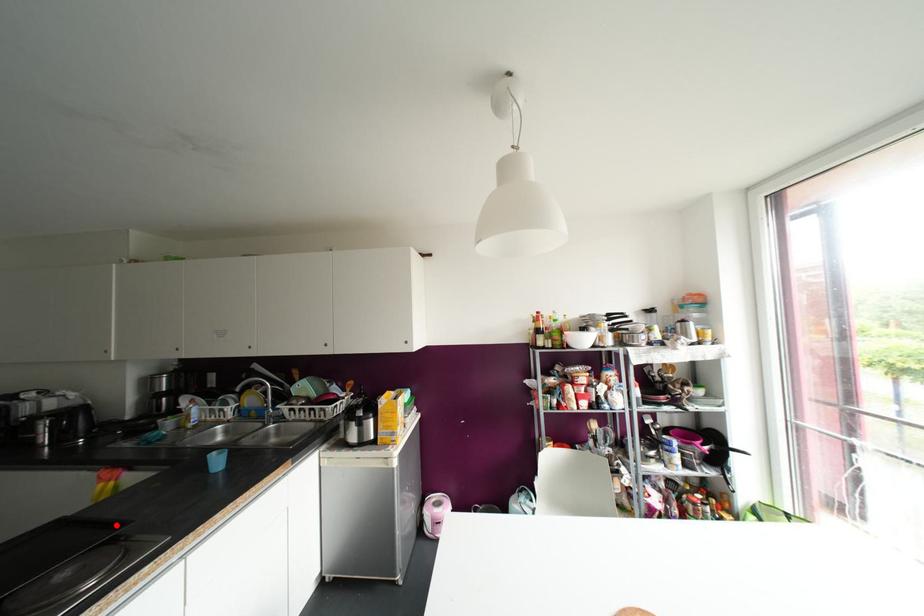
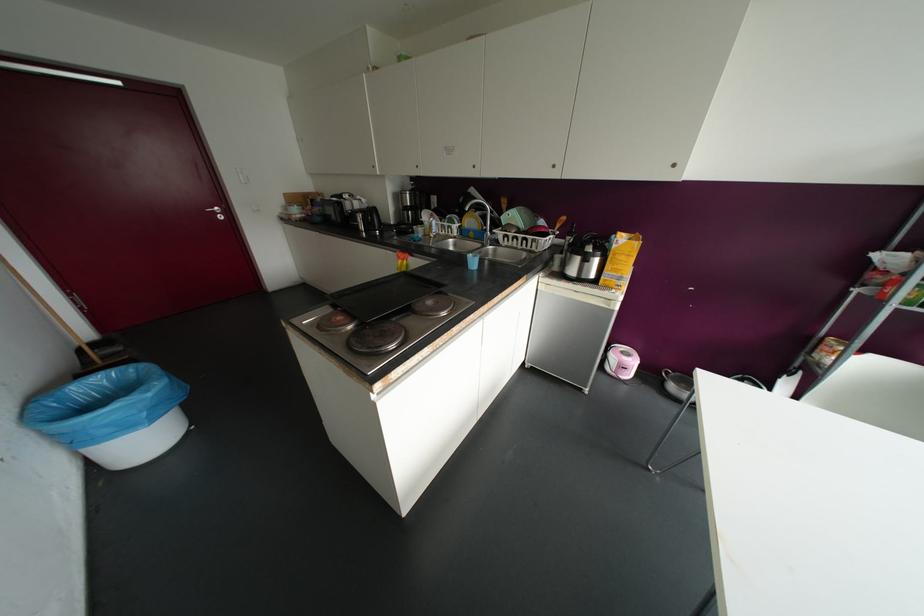
Find the pixel in the second image that matches the highlighted location in the first image.

(441, 284)